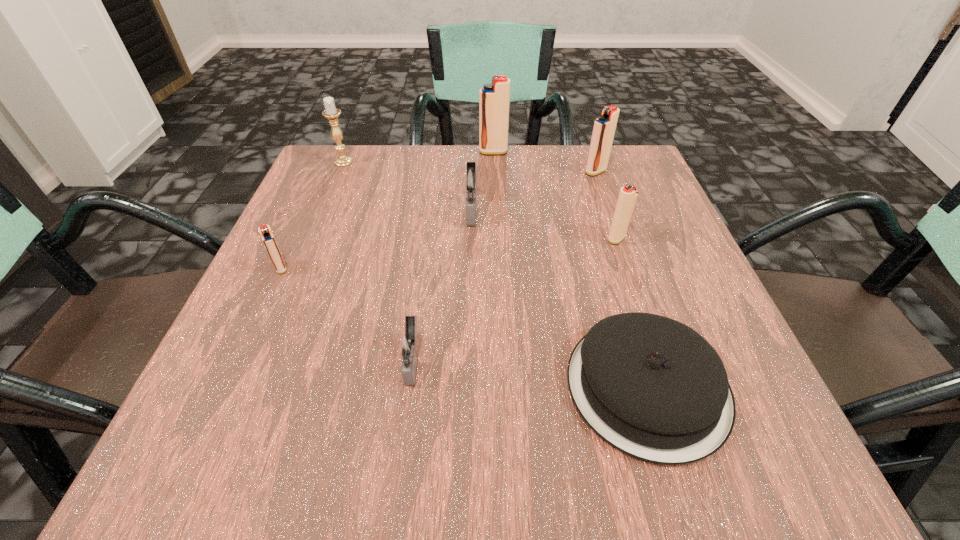
I want to click on free space located 0.080m on the right of the smaller gray igniter, so click(484, 361).

In order to click on vacant area situated on the back of the pancake in this screenshot , I will do [x=606, y=252].

The height and width of the screenshot is (540, 960). What are the coordinates of `candle holder at the far edge` in the screenshot? It's located at (331, 112).

At what (x,y) coordinates should I click in order to perform the action: click on object that is positioned at the near edge. Please return your answer as a coordinate pair (x, y). This screenshot has height=540, width=960. Looking at the image, I should click on (653, 388).

Find the location of a particular element. This screenshot has width=960, height=540. candle holder located in the left edge section of the desktop is located at coordinates (331, 112).

This screenshot has height=540, width=960. Identify the location of igniter located in the left edge section of the desktop. (267, 236).

Locate an element on the screen. pancake positioned at the right edge is located at coordinates (653, 388).

The height and width of the screenshot is (540, 960). Find the location of `object located at the far left corner`. object located at the far left corner is located at coordinates (331, 112).

You are a GUI agent. You are given a task and a screenshot of the screen. Output one action in this format:
    pyautogui.click(x=<x>, y=<y>)
    Task: Click on the object present at the far right corner
    
    Given the screenshot: What is the action you would take?
    pyautogui.click(x=604, y=127)

You are a GUI agent. You are given a task and a screenshot of the screen. Output one action in this format:
    pyautogui.click(x=<x>, y=<y>)
    Task: Click on the object that is at the near right corner
    
    Given the screenshot: What is the action you would take?
    tap(653, 388)